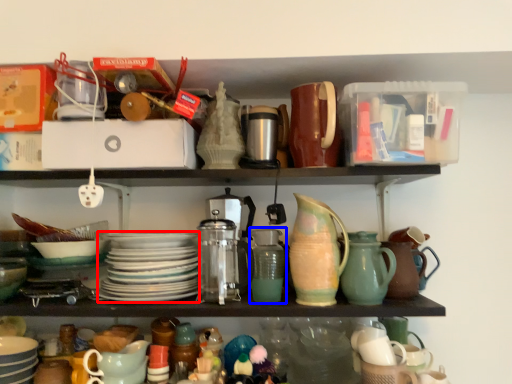
Question: Which object is further to the camera taking this photo, platter (highlighted by a red box) or pottery (highlighted by a blue box)?

Choices:
 (A) platter
 (B) pottery

Answer: (B)